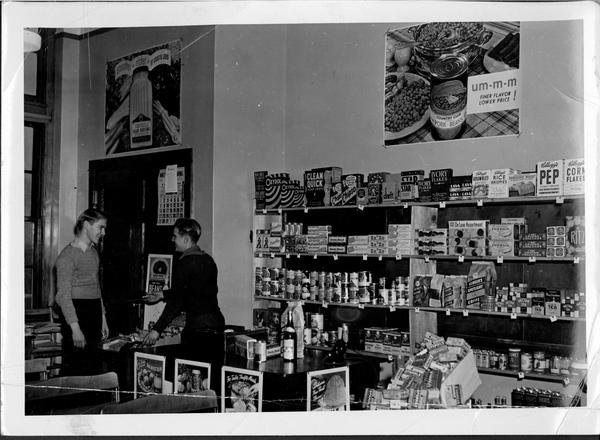
You are a GUI agent. You are given a task and a screenshot of the screen. Output one action in this format:
    pyautogui.click(x=<x>, y=<y>)
    Task: Click on the calendar
    Image resolution: width=600 pixels, height=440 pixels.
    Given the screenshot: What is the action you would take?
    pyautogui.click(x=172, y=200)